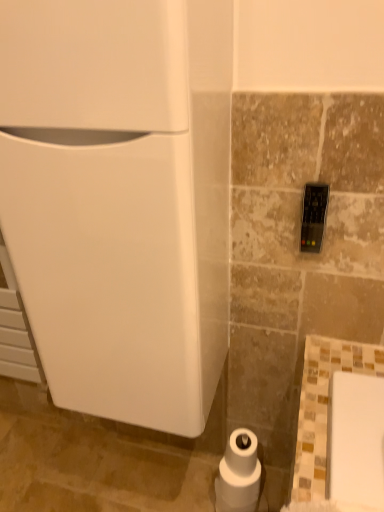
Image resolution: width=384 pixels, height=512 pixels. I want to click on white matte toilet paper at center, so [239, 473].

This screenshot has width=384, height=512. What do you see at coordinates (239, 473) in the screenshot?
I see `white matte toilet paper at center` at bounding box center [239, 473].

In order to face white matte toilet paper at center, should I rotate leftwards or rightwards?

To align with it, rotate right about 6.668°.

The height and width of the screenshot is (512, 384). I want to click on white glossy refrigerator at left, so click(x=120, y=199).

What do you see at coordinates (120, 199) in the screenshot? I see `white glossy refrigerator at left` at bounding box center [120, 199].

This screenshot has width=384, height=512. Find the location of `white matte toilet paper at center`. white matte toilet paper at center is located at coordinates (239, 473).

Between white matte toilet paper at center and white glossy refrigerator at left, which one appears on the left side from the viewer's perspective?

From the viewer's perspective, white glossy refrigerator at left appears more on the left side.

Which object is further away from the camera, white matte toilet paper at center or white glossy refrigerator at left?

white matte toilet paper at center is more distant.

Is point (245, 483) positioned before point (97, 296)?

That is False.

From the image's perspective, is white matte toilet paper at center above or below white glossy refrigerator at left?

Clearly, from the image's perspective, white matte toilet paper at center is below white glossy refrigerator at left.

From a real-world perspective, relative to white glossy refrigerator at left, is white matte toilet paper at center vertically above or below?

white matte toilet paper at center is situated lower than white glossy refrigerator at left in the real world.

In terms of width, does white matte toilet paper at center look wider or thinner when compared to white glossy refrigerator at left?

white matte toilet paper at center is thinner than white glossy refrigerator at left.

Does white matte toilet paper at center have a lesser height compared to white glossy refrigerator at left?

Yes.

Looking at the image, does white matte toilet paper at center seem bigger or smaller compared to white glossy refrigerator at left?

white matte toilet paper at center is smaller than white glossy refrigerator at left.

Is white glossy refrigerator at left surrounded by white matte toilet paper at center?

No, white glossy refrigerator at left is not surrounded by white matte toilet paper at center.

Are white matte toilet paper at center and white glossy refrigerator at left beside each other?

No.

Is white matte toilet paper at center aimed at white glossy refrigerator at left?

No, white matte toilet paper at center is not oriented towards white glossy refrigerator at left.

Can you tell me how much white matte toilet paper at center and white glossy refrigerator at left differ in facing direction?

They differ by 1.43 degrees in their facing directions.

You are a GUI agent. You are given a task and a screenshot of the screen. Output one action in this format:
    pyautogui.click(x=<x>, y=<y>)
    Task: Click on the appliance that is on the left side of white matte toilet paper at center
    The width and height of the screenshot is (384, 512).
    Given the screenshot: What is the action you would take?
    pyautogui.click(x=120, y=199)

Would you say white glossy refrigerator at left is to the left or to the right of white matte toilet paper at center in the picture?

In the image, white glossy refrigerator at left appears on the left side of white matte toilet paper at center.

Considering the positions of objects white glossy refrigerator at left and white matte toilet paper at center in the image provided, who is behind, white glossy refrigerator at left or white matte toilet paper at center?

white matte toilet paper at center is further from the camera.

Is point (129, 410) closer or farther from the camera than point (252, 454)?

Point (129, 410) is positioned closer to the camera compared to point (252, 454).

From the image's perspective, relative to white matte toilet paper at center, is white glossy refrigerator at left above or below?

white glossy refrigerator at left is situated higher than white matte toilet paper at center in the image.

From a real-world perspective, relative to white matte toilet paper at center, is white glossy refrigerator at left vertically above or below?

white glossy refrigerator at left is above white matte toilet paper at center.

Which of these two, white glossy refrigerator at left or white matte toilet paper at center, is wider?

With larger width is white glossy refrigerator at left.

Considering the relative sizes of white glossy refrigerator at left and white matte toilet paper at center in the image provided, is white glossy refrigerator at left shorter than white matte toilet paper at center?

Incorrect, the height of white glossy refrigerator at left does not fall short of that of white matte toilet paper at center.

Does white glossy refrigerator at left have a larger size compared to white matte toilet paper at center?

Correct, white glossy refrigerator at left is larger in size than white matte toilet paper at center.

Is white glossy refrigerator at left not within white matte toilet paper at center?

Absolutely, white glossy refrigerator at left is external to white matte toilet paper at center.

Does white glossy refrigerator at left touch white matte toilet paper at center?

No, white glossy refrigerator at left is not in contact with white matte toilet paper at center.

Is white glossy refrigerator at left oriented towards white matte toilet paper at center?

No, white glossy refrigerator at left is not turned towards white matte toilet paper at center.

Can you tell me how much white glossy refrigerator at left and white matte toilet paper at center differ in facing direction?

1.43 degrees.

How distant is white glossy refrigerator at left from white matte toilet paper at center?

white glossy refrigerator at left and white matte toilet paper at center are 27.15 inches apart from each other.

Identify the location of toilet paper behind the white glossy refrigerator at left. The width and height of the screenshot is (384, 512). (239, 473).

Where is `toilet paper behind the white glossy refrigerator at left`? toilet paper behind the white glossy refrigerator at left is located at coordinates click(239, 473).

At what (x,y) coordinates should I click in order to perform the action: click on toilet paper below the white glossy refrigerator at left (from the image's perspective). Please return your answer as a coordinate pair (x, y). The height and width of the screenshot is (512, 384). Looking at the image, I should click on (239, 473).